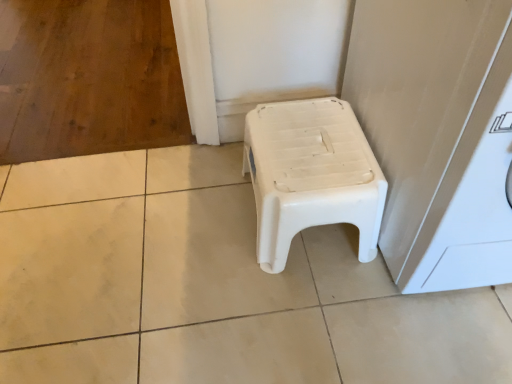
Question: From the image's perspective, does white plastic washing machine at right appear higher than white plastic stool at center?

Choices:
 (A) no
 (B) yes

Answer: (B)

Question: Does white plastic washing machine at right have a lesser height compared to white plastic stool at center?

Choices:
 (A) yes
 (B) no

Answer: (B)

Question: Is white plastic washing machine at right positioned in front of white plastic stool at center?

Choices:
 (A) yes
 (B) no

Answer: (A)

Question: Is white plastic washing machine at right at the right side of white plastic stool at center?

Choices:
 (A) yes
 (B) no

Answer: (A)

Question: Is white plastic stool at center located within white plastic washing machine at right?

Choices:
 (A) yes
 (B) no

Answer: (B)

Question: From the image's perspective, is white plastic washing machine at right located beneath white plastic stool at center?

Choices:
 (A) no
 (B) yes

Answer: (A)

Question: Considering the relative positions of white plastic stool at center and white plastic washing machine at right in the image provided, is white plastic stool at center to the left of white plastic washing machine at right from the viewer's perspective?

Choices:
 (A) yes
 (B) no

Answer: (A)

Question: Is white plastic stool at center completely or partially outside of white plastic washing machine at right?

Choices:
 (A) yes
 (B) no

Answer: (A)

Question: Is white plastic stool at center bigger than white plastic washing machine at right?

Choices:
 (A) no
 (B) yes

Answer: (A)

Question: Is white plastic stool at center positioned in front of white plastic washing machine at right?

Choices:
 (A) no
 (B) yes

Answer: (A)

Question: Is white plastic stool at center taller than white plastic washing machine at right?

Choices:
 (A) yes
 (B) no

Answer: (B)

Question: Can you confirm if white plastic stool at center is thinner than white plastic washing machine at right?

Choices:
 (A) yes
 (B) no

Answer: (A)

Question: Considering the positions of point (283, 240) and point (477, 195), is point (283, 240) closer or farther from the camera than point (477, 195)?

Choices:
 (A) farther
 (B) closer

Answer: (A)